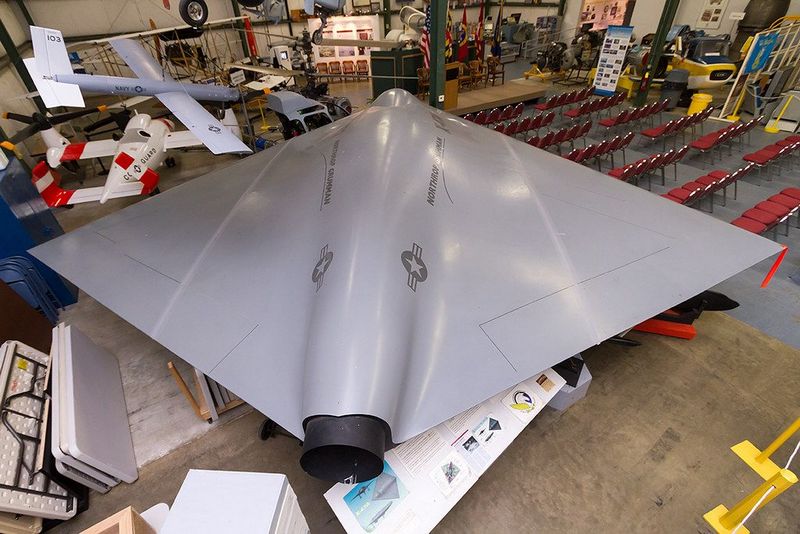
At what (x,y) coordinates should I click in order to perform the action: click on table. Please return your answer as a coordinate pair (x, y). Image resolution: width=800 pixels, height=534 pixels. Looking at the image, I should click on (113, 444).